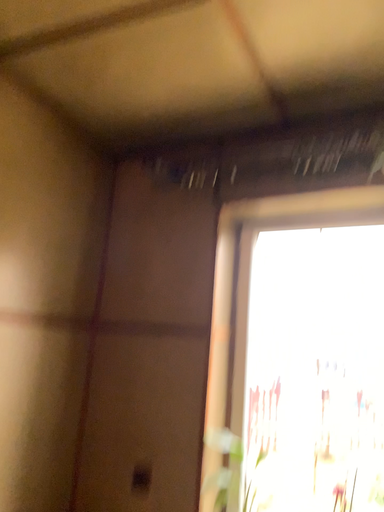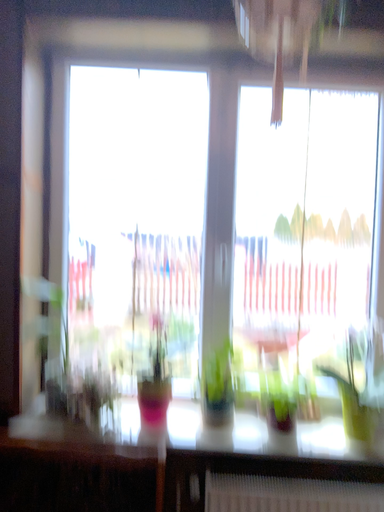
Question: How did the camera likely rotate when shooting the video?

Choices:
 (A) rotated upward
 (B) rotated downward

Answer: (B)